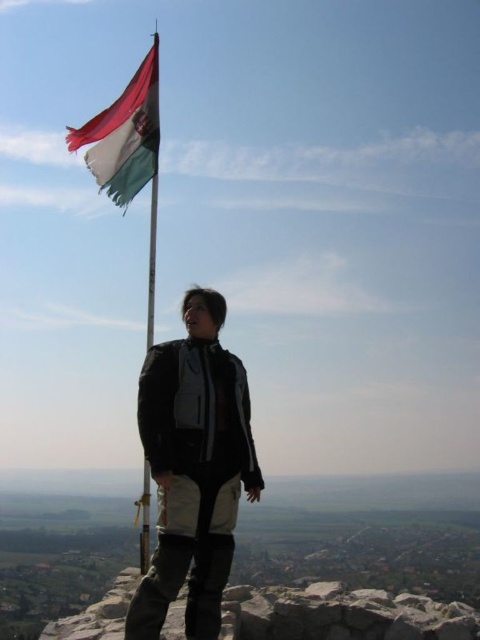
Does rough stone at lower center have a larger size compared to metallic flagpole at upper left?

Correct, rough stone at lower center is larger in size than metallic flagpole at upper left.

Can you confirm if rough stone at lower center is positioned above metallic flagpole at upper left?

No, rough stone at lower center is not above metallic flagpole at upper left.

Which is in front, point (269, 589) or point (144, 545)?

Point (144, 545) is in front.

The width and height of the screenshot is (480, 640). In order to click on rough stone at lower center in this screenshot , I will do `click(340, 614)`.

Who is taller, black matte jacket at center or metallic flagpole at upper left?

Standing taller between the two is metallic flagpole at upper left.

Does point (261, 477) lie in front of point (146, 477)?

No, it is behind (146, 477).

Image resolution: width=480 pixels, height=640 pixels. What do you see at coordinates (193, 467) in the screenshot? I see `black matte jacket at center` at bounding box center [193, 467].

This screenshot has height=640, width=480. What are the coordinates of `black matte jacket at center` in the screenshot? It's located at coord(193,467).

Can you confirm if rough stone at lower center is wider than tri-color fabric flag at upper left?

Yes, rough stone at lower center is wider than tri-color fabric flag at upper left.

The height and width of the screenshot is (640, 480). I want to click on rough stone at lower center, so click(x=340, y=614).

Where is `rough stone at lower center`? rough stone at lower center is located at coordinates (340, 614).